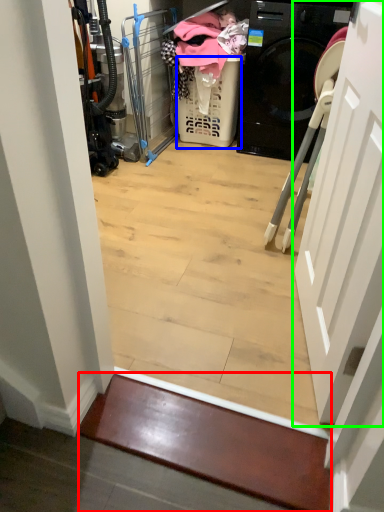
Question: Estimate the real-world distances between objects in this image. Which object is closer to stairwell (highlighted by a red box), basket (highlighted by a blue box) or door (highlighted by a green box)?

Choices:
 (A) basket
 (B) door

Answer: (B)